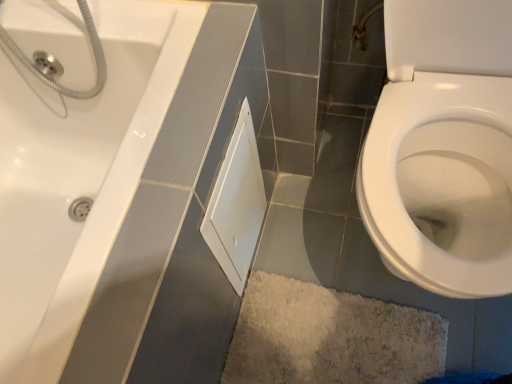
Question: Is white matte cabinet at center wider or thinner than white glossy bidet at lower right?

Choices:
 (A) thin
 (B) wide

Answer: (A)

Question: Is white matte cabinet at center inside the boundaries of white glossy bidet at lower right, or outside?

Choices:
 (A) inside
 (B) outside

Answer: (B)

Question: From their relative heights in the image, would you say white matte cabinet at center is taller or shorter than white glossy bidet at lower right?

Choices:
 (A) short
 (B) tall

Answer: (A)

Question: From the image's perspective, is white glossy bidet at lower right positioned above or below white matte cabinet at center?

Choices:
 (A) below
 (B) above

Answer: (B)

Question: Based on their positions, is white glossy bidet at lower right located to the left or right of white matte cabinet at center?

Choices:
 (A) left
 (B) right

Answer: (B)

Question: Considering the positions of white glossy bidet at lower right and white matte cabinet at center in the image, is white glossy bidet at lower right taller or shorter than white matte cabinet at center?

Choices:
 (A) short
 (B) tall

Answer: (B)

Question: Considering the positions of white glossy bidet at lower right and white matte cabinet at center in the image, is white glossy bidet at lower right wider or thinner than white matte cabinet at center?

Choices:
 (A) thin
 (B) wide

Answer: (B)